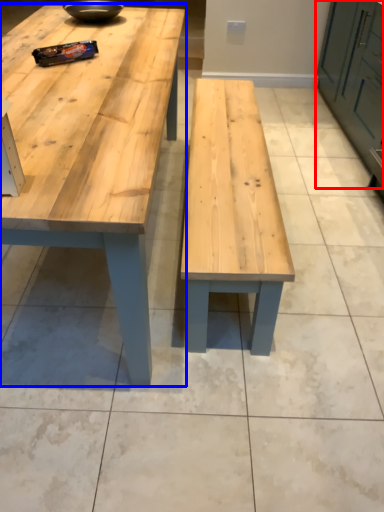
Question: Which point is further to the camera, cabinetry (highlighted by a red box) or table (highlighted by a blue box)?

Choices:
 (A) cabinetry
 (B) table

Answer: (A)